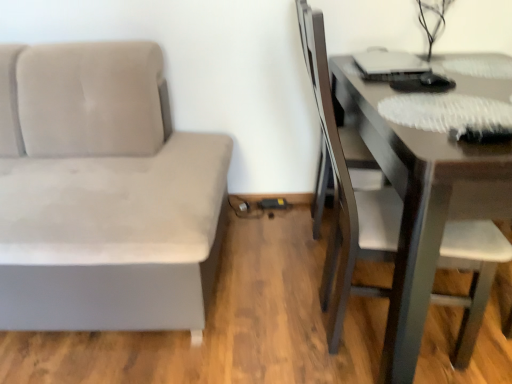
Image resolution: width=512 pixels, height=384 pixels. What do you see at coordinates (421, 203) in the screenshot?
I see `dark brown wooden table at right` at bounding box center [421, 203].

Locate an element on the screen. matte black swivel chair at right is located at coordinates (328, 119).

Can you confirm if dark brown wooden table at right is taller than suede gray couch at left?

No.

From a real-world perspective, between dark brown wooden table at right and suede gray couch at left, who is vertically lower?

In real-world perspective, dark brown wooden table at right is lower.

Considering the relative sizes of dark brown wooden table at right and suede gray couch at left in the image provided, is dark brown wooden table at right bigger than suede gray couch at left?

Incorrect, dark brown wooden table at right is not larger than suede gray couch at left.

Is dark brown wooden table at right positioned with its back to matte black swivel chair at right?

Correct, dark brown wooden table at right is looking away from matte black swivel chair at right.

Is dark brown wooden table at right positioned far away from matte black swivel chair at right?

No.

Does dark brown wooden table at right have a lesser height compared to matte black swivel chair at right?

Yes, dark brown wooden table at right is shorter than matte black swivel chair at right.

Does dark brown wooden table at right lie in front of matte black swivel chair at right?

Yes, dark brown wooden table at right is closer to the camera.

Considering the positions of objects suede gray couch at left and dark brown wooden table at right in the image provided, who is more to the right, suede gray couch at left or dark brown wooden table at right?

From the viewer's perspective, dark brown wooden table at right appears more on the right side.

From the image's perspective, is suede gray couch at left located above or below dark brown wooden table at right?

suede gray couch at left is above dark brown wooden table at right.

From their relative heights in the image, would you say suede gray couch at left is taller or shorter than dark brown wooden table at right?

Considering their sizes, suede gray couch at left has more height than dark brown wooden table at right.

Is suede gray couch at left with dark brown wooden table at right?

No, suede gray couch at left is not touching dark brown wooden table at right.

Does matte black swivel chair at right touch dark brown wooden table at right?

No, matte black swivel chair at right is not in contact with dark brown wooden table at right.

Considering the positions of point (354, 148) and point (381, 120), is point (354, 148) closer or farther from the camera than point (381, 120)?

Clearly, point (354, 148) is more distant from the camera than point (381, 120).

Between matte black swivel chair at right and dark brown wooden table at right, which one is positioned behind?

Positioned behind is matte black swivel chair at right.

From the image's perspective, is matte black swivel chair at right located above or below dark brown wooden table at right?

matte black swivel chair at right is above dark brown wooden table at right.

From the image's perspective, does suede gray couch at left appear lower than matte black swivel chair at right?

Yes, from the image's perspective, suede gray couch at left is beneath matte black swivel chair at right.

Do you think suede gray couch at left is within matte black swivel chair at right, or outside of it?

suede gray couch at left is spatially situated outside matte black swivel chair at right.

How different are the orientations of suede gray couch at left and matte black swivel chair at right in degrees?

They differ by 88.4 degrees in their facing directions.

Is matte black swivel chair at right facing away from suede gray couch at left?

Yes.

Which of these two, matte black swivel chair at right or suede gray couch at left, is thinner?

With smaller width is matte black swivel chair at right.

Is point (361, 146) farther from viewer compared to point (106, 90)?

Yes, it is.

Are matte black swivel chair at right and suede gray couch at left far apart?

No, there isn't a large distance between matte black swivel chair at right and suede gray couch at left.

Find the location of a particular element. table below the suede gray couch at left (from the image's perspective) is located at coordinates (421, 203).

Find the location of a particular element. This screenshot has width=512, height=384. swivel chair above the dark brown wooden table at right (from the image's perspective) is located at coordinates (328, 119).

Considering their positions, is suede gray couch at left positioned closer to matte black swivel chair at right than dark brown wooden table at right?

Based on the image, dark brown wooden table at right appears to be nearer to matte black swivel chair at right.

Looking at the image, which one is located closer to suede gray couch at left, dark brown wooden table at right or matte black swivel chair at right?

dark brown wooden table at right.

Looking at the image, which one is located further to suede gray couch at left, matte black swivel chair at right or dark brown wooden table at right?

Among the two, matte black swivel chair at right is located further to suede gray couch at left.

Looking at the image, which one is located closer to dark brown wooden table at right, suede gray couch at left or matte black swivel chair at right?

Among the two, matte black swivel chair at right is located nearer to dark brown wooden table at right.

Estimate the real-world distances between objects in this image. Which object is closer to matte black swivel chair at right, dark brown wooden table at right or suede gray couch at left?

dark brown wooden table at right is positioned closer to the anchor matte black swivel chair at right.

Which object lies further to the anchor point dark brown wooden table at right, matte black swivel chair at right or suede gray couch at left?

Among the two, suede gray couch at left is located further to dark brown wooden table at right.

Identify the location of swivel chair between suede gray couch at left and dark brown wooden table at right in the horizontal direction. This screenshot has height=384, width=512. (328, 119).